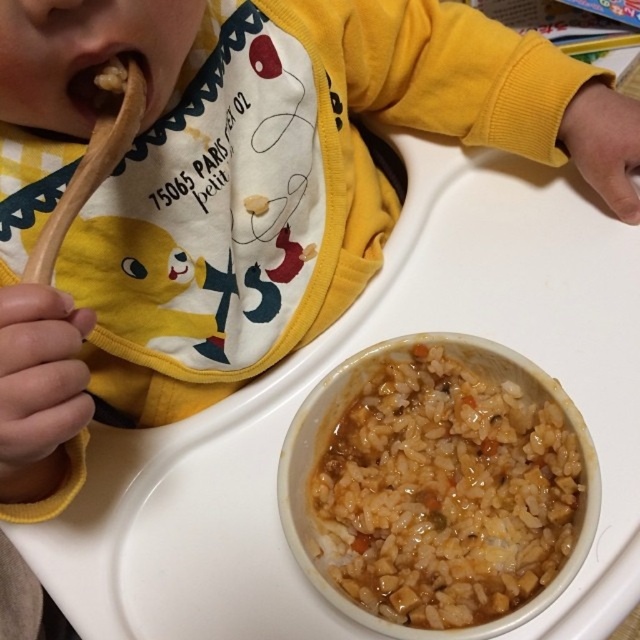
Based on the coordinates provided, where is the brown matte rice at center located in the image?

The brown matte rice at center is located at point (444, 492) in the image.

The child is trying to eat the brown matte food at mouth left with the wooden spoon at upper left. Is the spoon positioned correctly to scoop the food?

The wooden spoon at upper left is positioned under brown matte food at mouth left, so yes, the spoon is correctly placed to scoop the food.